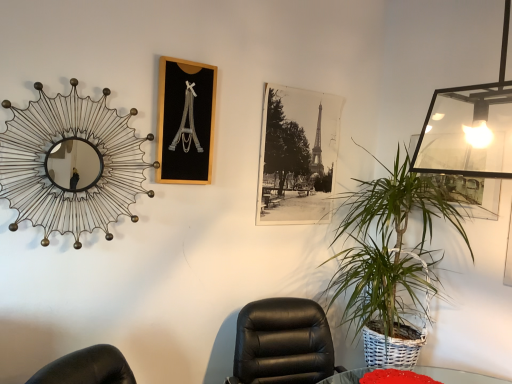
Question: From the image's perspective, is black wood picture frame at upper center, marked as the second picture frame in a right-to-left arrangement, above black leather chair at center?

Choices:
 (A) no
 (B) yes

Answer: (B)

Question: Is black wood picture frame at upper center, the 1th picture frame when ordered from left to right, touching black leather chair at center?

Choices:
 (A) yes
 (B) no

Answer: (B)

Question: Is black wood picture frame at upper center, the 2th picture frame viewed from the back, located outside black leather chair at center?

Choices:
 (A) no
 (B) yes

Answer: (B)

Question: Is the position of black wood picture frame at upper center, the 2th picture frame viewed from the back, less distant than that of black leather chair at center?

Choices:
 (A) no
 (B) yes

Answer: (A)

Question: Can you confirm if black wood picture frame at upper center, the 2th picture frame viewed from the back, is smaller than black leather chair at center?

Choices:
 (A) no
 (B) yes

Answer: (B)

Question: In the image, is black paper photo at center, marked as the 2th picture frame in a left-to-right arrangement, positioned in front of or behind black leather chair at center?

Choices:
 (A) front
 (B) behind

Answer: (B)

Question: Is point (326, 104) positioned closer to the camera than point (302, 372)?

Choices:
 (A) closer
 (B) farther

Answer: (B)

Question: Is black paper photo at center, placed as the second picture frame when sorted from front to back, to the left or to the right of black leather chair at center in the image?

Choices:
 (A) right
 (B) left

Answer: (A)

Question: From their relative heights in the image, would you say black paper photo at center, placed as the second picture frame when sorted from front to back, is taller or shorter than black leather chair at center?

Choices:
 (A) short
 (B) tall

Answer: (B)

Question: Is point click(440, 256) positioned closer to the camera than point click(185, 175)?

Choices:
 (A) closer
 (B) farther

Answer: (B)

Question: Would you say green woven basket at right is inside or outside black wood picture frame at upper center, the 2th picture frame viewed from the back?

Choices:
 (A) outside
 (B) inside

Answer: (A)

Question: From the image's perspective, relative to black wood picture frame at upper center, the 1th picture frame when ordered from left to right, is green woven basket at right above or below?

Choices:
 (A) above
 (B) below

Answer: (B)

Question: Relative to black wood picture frame at upper center, marked as the second picture frame in a right-to-left arrangement, is green woven basket at right in front or behind?

Choices:
 (A) front
 (B) behind

Answer: (A)

Question: Does point (119, 173) appear closer or farther from the camera than point (159, 177)?

Choices:
 (A) closer
 (B) farther

Answer: (A)

Question: From a real-world perspective, is metallic wire mirror at upper left above or below black wood picture frame at upper center, the 2th picture frame viewed from the back?

Choices:
 (A) above
 (B) below

Answer: (B)